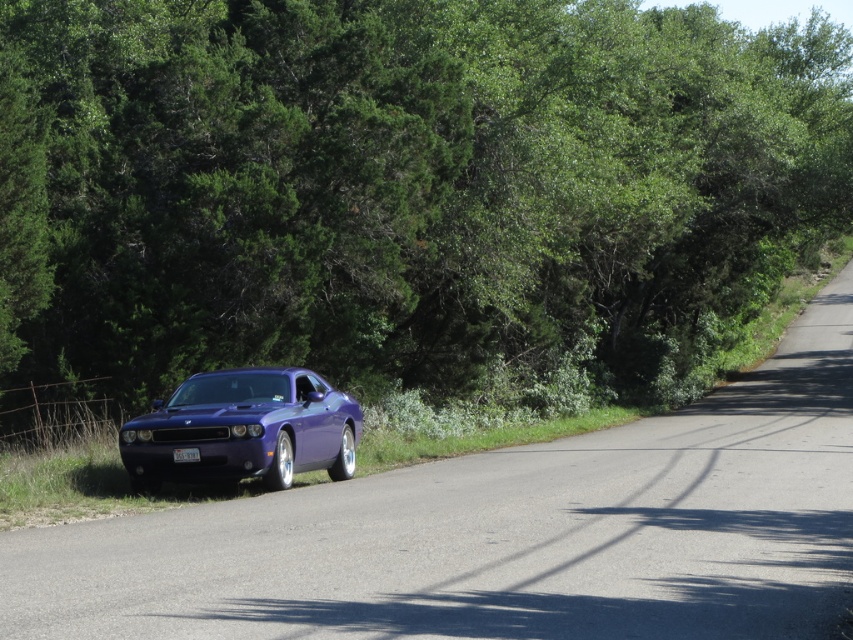
You are a photographer planning to take a picture of the glossy metallic car at center. You want to ensure the green leafy tree at center is visible in the background but not blocking the car. Is the size of the tree such that it can be framed this way?

The green leafy tree at center is larger in size than the glossy metallic car at center. Since the tree is larger, it might block the car if positioned too close, so you need to adjust the camera angle or distance to ensure the car remains the focus while the tree is visible in the background.

You are a photographer wanting to capture the glossy metallic car at center without any obstructions. Is the green leafy tree at center blocking the view of the car?

The green leafy tree at center is above the glossy metallic car at center, so it is blocking the view of the car.

You are a photographer planning to capture a photo of the glossy metallic car at center and the green leafy tree at center. Based on their heights, which object would appear taller in the photo?

The green leafy tree at center appears taller in the photo because it has a greater height compared to the glossy metallic car at center.